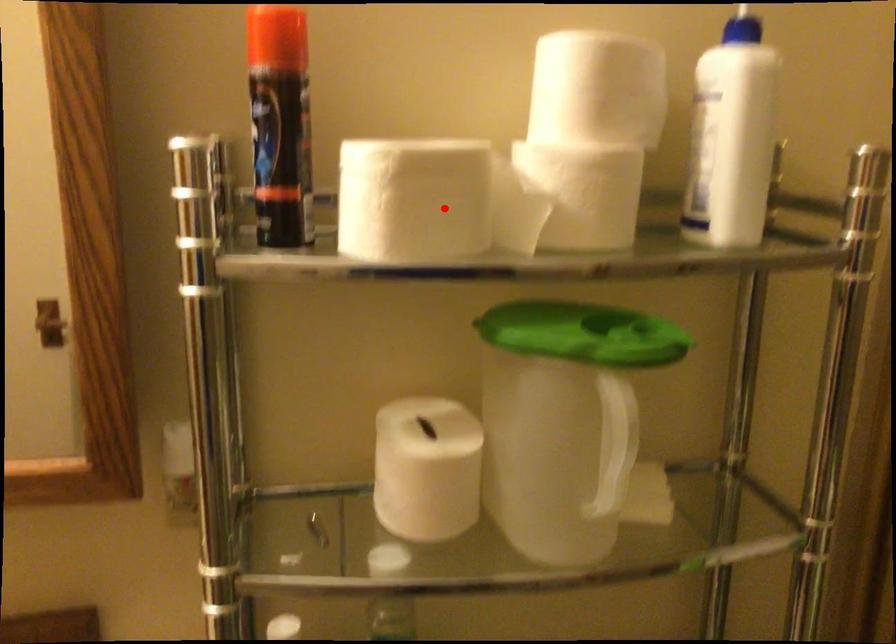
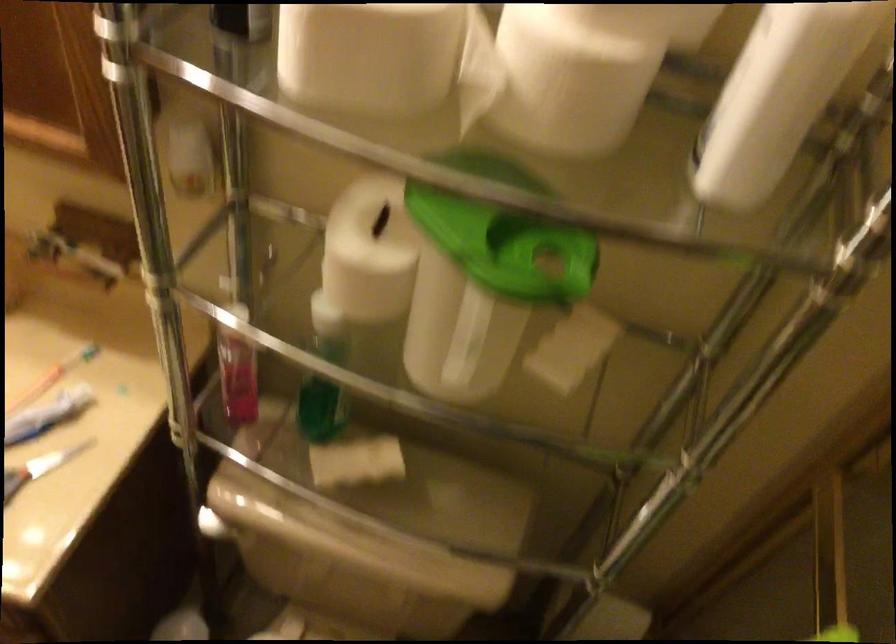
In the second image, find the point that corresponds to the highlighted location in the first image.

(368, 55)